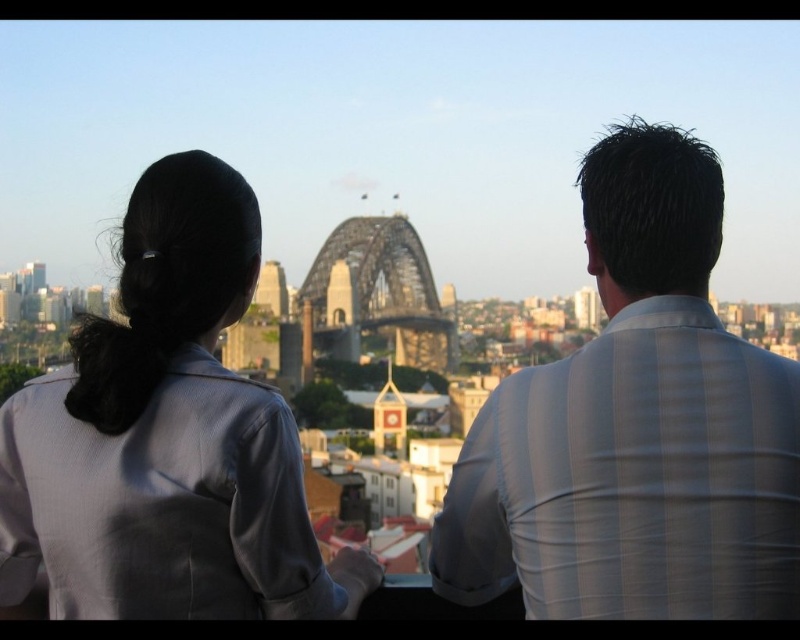
Between white striped shirt at upper right and metallic bridge at center, which one has more height?

white striped shirt at upper right is taller.

From the picture: Which of these two, white striped shirt at upper right or metallic bridge at center, stands shorter?

Standing shorter between the two is metallic bridge at center.

Describe the element at coordinates (636, 428) in the screenshot. The image size is (800, 640). I see `white striped shirt at upper right` at that location.

The image size is (800, 640). Identify the location of white striped shirt at upper right. (636, 428).

Does matte gray blazer at left appear under metallic bridge at center?

Indeed, matte gray blazer at left is positioned under metallic bridge at center.

Which is in front, point (29, 509) or point (400, 275)?

Point (29, 509)

Is point (286, 508) less distant than point (377, 323)?

Yes, it is in front of point (377, 323).

Identify the location of matte gray blazer at left. (168, 438).

Is point (494, 472) in front of point (148, 294)?

No, it is not.

Is white striped shirt at upper right positioned at the back of matte gray blazer at left?

Yes.

Is point (721, 340) positioned after point (78, 388)?

Yes, it is.

Locate an element on the screen. The width and height of the screenshot is (800, 640). white striped shirt at upper right is located at coordinates (636, 428).